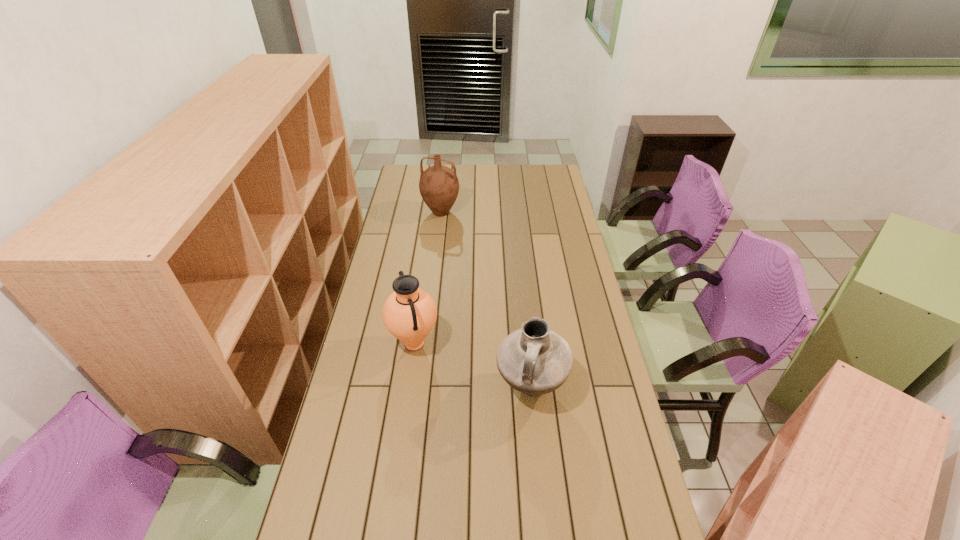
Identify which pitcher is the closest to the farthest pitcher. Please provide its 2D coordinates. Your answer should be formatted as a tuple, i.e. [(x, y)], where the tuple contains the x and y coordinates of a point satisfying the conditions above.

[(409, 313)]

At what (x,y) coordinates should I click in order to perform the action: click on pitcher that can be found as the second closest to the farthest object. Please return your answer as a coordinate pair (x, y). This screenshot has height=540, width=960. Looking at the image, I should click on (534, 360).